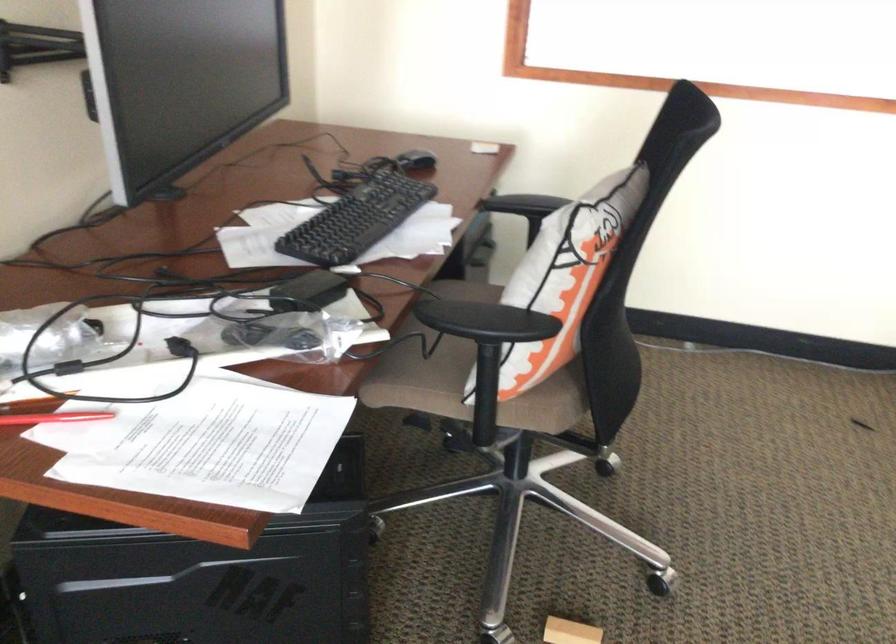
This screenshot has height=644, width=896. In order to click on black computer keyboard in this screenshot , I will do `click(356, 220)`.